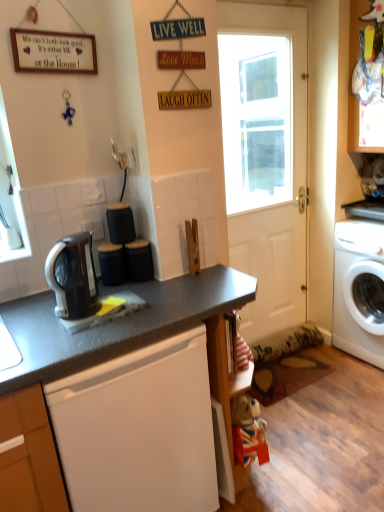
You are a GUI agent. You are given a task and a screenshot of the screen. Output one action in this format:
    pyautogui.click(x=<x>, y=<y>)
    Task: Click on the spots to the right of matte black coffee maker at center, which is counted as the second appliance, starting from the right
    This screenshot has height=512, width=384.
    Given the screenshot: What is the action you would take?
    pyautogui.click(x=165, y=282)